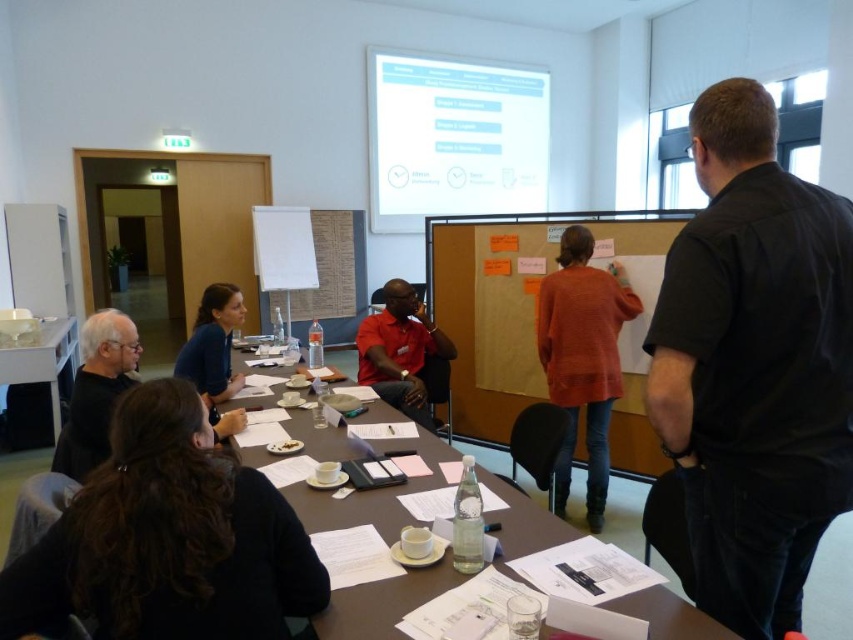
Question: Does white glossy projection screen at upper center have a greater width compared to matte black table at center?

Choices:
 (A) no
 (B) yes

Answer: (B)

Question: Is black shirt at right above matte white table at lower left?

Choices:
 (A) no
 (B) yes

Answer: (B)

Question: Which point appears farthest from the camera in this image?

Choices:
 (A) (514, 285)
 (B) (73, 316)

Answer: (B)

Question: Does white glossy projection screen at upper center have a smaller size compared to matte black shirt at lower left?

Choices:
 (A) yes
 (B) no

Answer: (B)

Question: Which of the following is the farthest from the observer?

Choices:
 (A) white glossy projection screen at upper center
 (B) matte black table at center

Answer: (A)

Question: Which is nearer to the matte white table at lower left?

Choices:
 (A) matte black shirt at lower left
 (B) white glossy projection screen at upper center

Answer: (A)